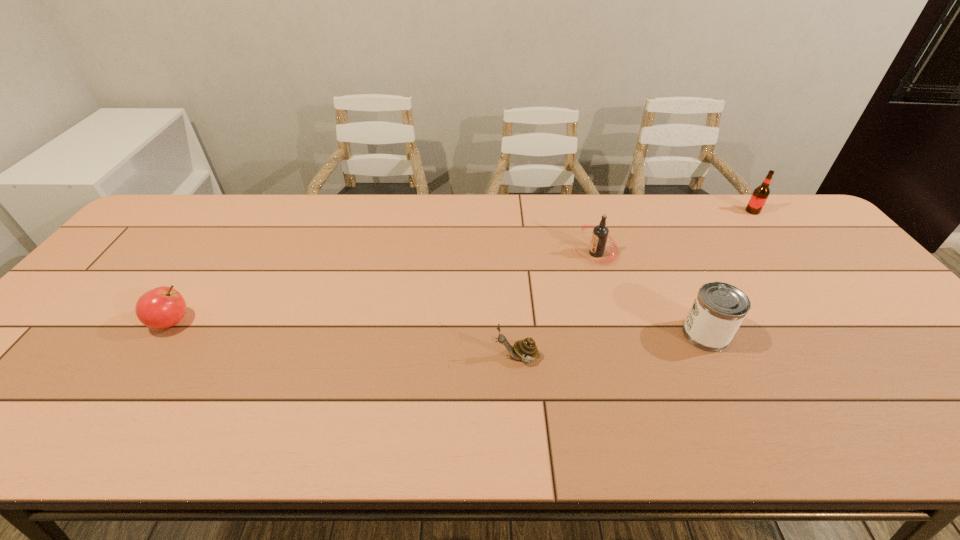
Identify the location of the rightmost object. The image size is (960, 540). (760, 194).

What are the coordinates of `the farthest object` in the screenshot? It's located at [x=760, y=194].

Where is `the second farthest object`? The height and width of the screenshot is (540, 960). the second farthest object is located at coordinates (600, 234).

The height and width of the screenshot is (540, 960). In order to click on the third object from left to right in this screenshot , I will do `click(600, 234)`.

Identify the location of the fourth object from left to right. (718, 310).

The width and height of the screenshot is (960, 540). Identify the location of snail. (526, 349).

Identify the location of apple. This screenshot has width=960, height=540. (162, 307).

This screenshot has height=540, width=960. I want to click on vacant space located on the front of the right root beer, so click(x=819, y=295).

Where is `free space located on the label of the third object from right to left`? free space located on the label of the third object from right to left is located at coordinates (538, 253).

Locate an element on the screen. free location located on the label of the third object from right to left is located at coordinates point(508,253).